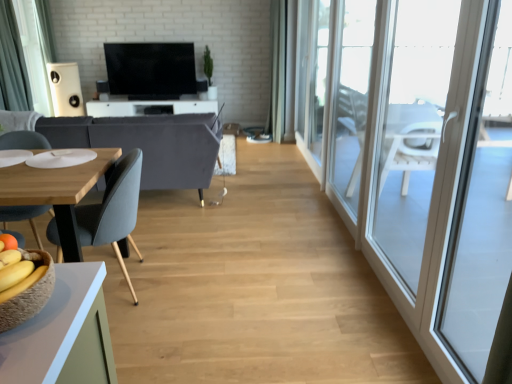
Question: From a real-world perspective, relative to dark gray fabric curtain at left, is flat screen tv at center vertically above or below?

Choices:
 (A) below
 (B) above

Answer: (A)

Question: Considering the positions of point (155, 99) and point (7, 18), is point (155, 99) closer or farther from the camera than point (7, 18)?

Choices:
 (A) farther
 (B) closer

Answer: (A)

Question: Which of these objects is positioned closest to the dark gray fabric curtain at left?

Choices:
 (A) white glossy tv stand at center, the first table in the top-to-bottom sequence
 (B) matte gray chair at left
 (C) transparent glass door at right, which appears as the third window when viewed from the back
 (D) flat screen tv at center
 (E) transparent glass window at right, marked as the 1th window in a back-to-front arrangement

Answer: (A)

Question: Estimate the real-world distances between objects in this image. Which object is closer to the velvet grey couch at left?

Choices:
 (A) transparent glass door at right, which appears as the third window when viewed from the back
 (B) transparent glass screen door at right
 (C) white matte speaker at upper left
 (D) transparent glass window at right, marked as the 1th window in a back-to-front arrangement
 (E) wooden table at lower left, which ranks as the first table in front-to-back order

Answer: (E)